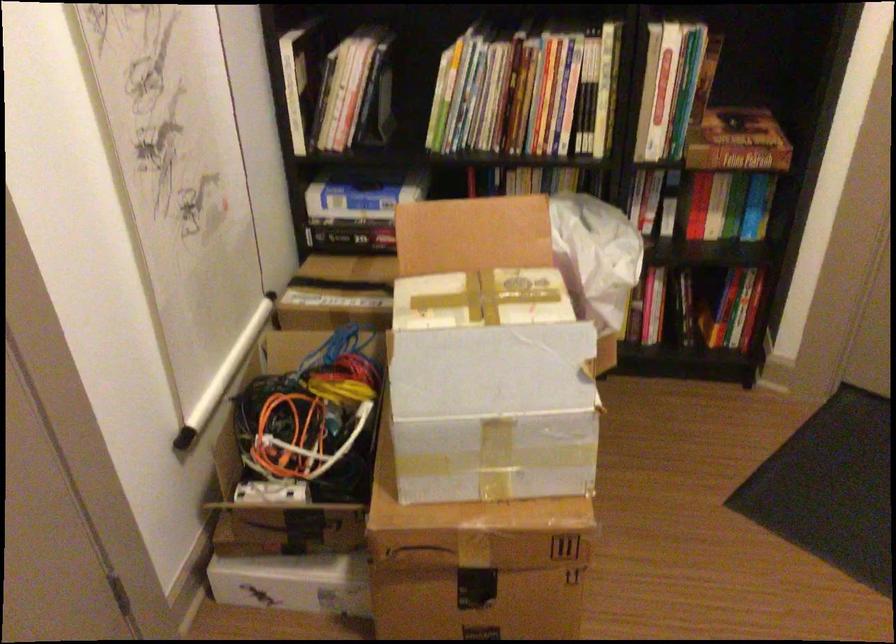
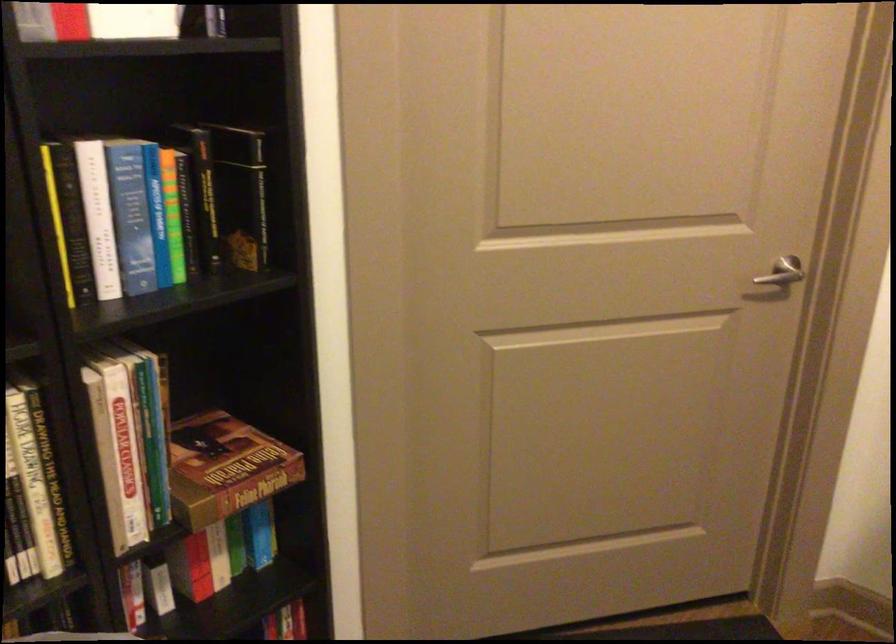
Locate, in the second image, the point that corresponds to (734,135) in the first image.

(225, 468)